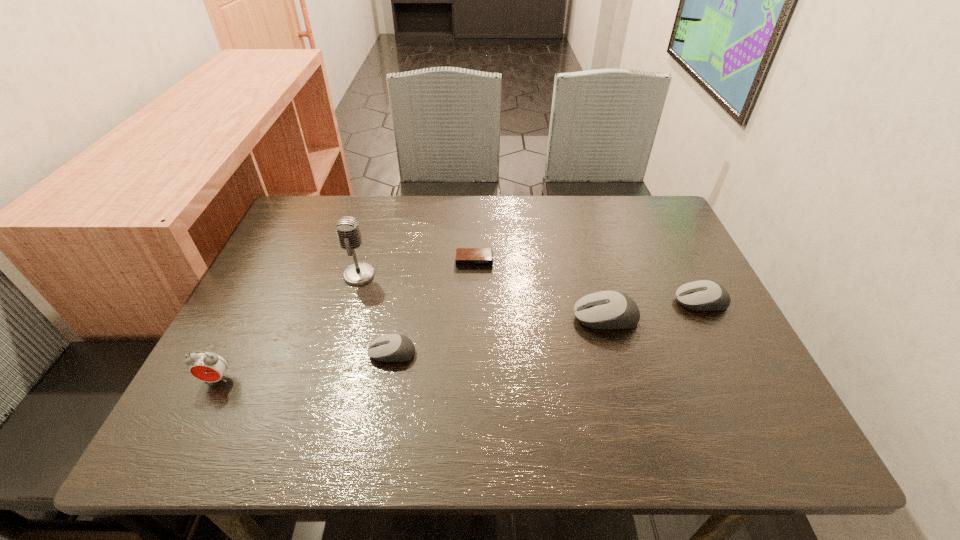
In the image, there is a desktop. Where is `free space at the right edge`? free space at the right edge is located at coordinates (687, 259).

You are a GUI agent. You are given a task and a screenshot of the screen. Output one action in this format:
    pyautogui.click(x=<x>, y=<y>)
    Task: Click on the vacant space at the far left corner of the desktop
    
    Given the screenshot: What is the action you would take?
    (x=297, y=208)

The image size is (960, 540). In order to click on vacant space at the near left corner in this screenshot , I will do [x=206, y=382].

Where is `vacant area at the far right corner`? This screenshot has height=540, width=960. vacant area at the far right corner is located at coordinates (658, 228).

In the image, there is a desktop. Identify the location of free space at the near right corner. This screenshot has width=960, height=540. (703, 390).

Find the location of a particular element. The width and height of the screenshot is (960, 540). vacant region between the microphone and the leftmost object is located at coordinates (288, 327).

This screenshot has width=960, height=540. Identify the location of free space between the nearest object and the right alarm clock. (346, 320).

Find the location of a particular element. This screenshot has height=540, width=960. vacant area that lies between the rightmost computer equipment and the taller alarm clock is located at coordinates (459, 341).

Find the location of a particular element. The height and width of the screenshot is (540, 960). vacant area that lies between the leftmost object and the fifth tallest object is located at coordinates click(x=304, y=366).

Identify the location of vacant area that lies between the second computer equipment from left to right and the rightmost object. (653, 310).